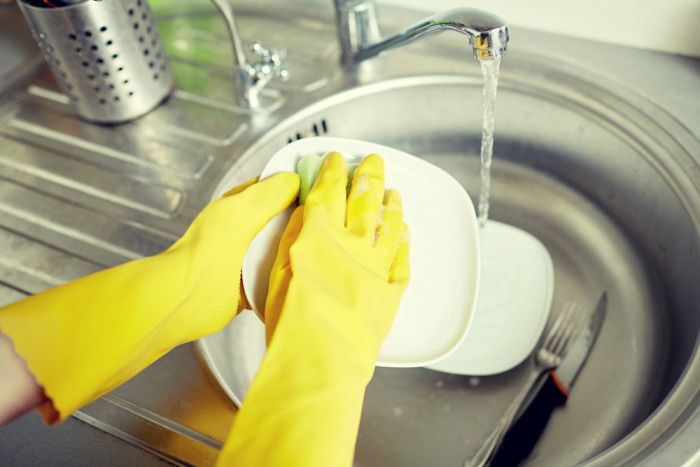
Find the location of a particular element. Image resolution: width=700 pixels, height=467 pixels. sink is located at coordinates (624, 219).